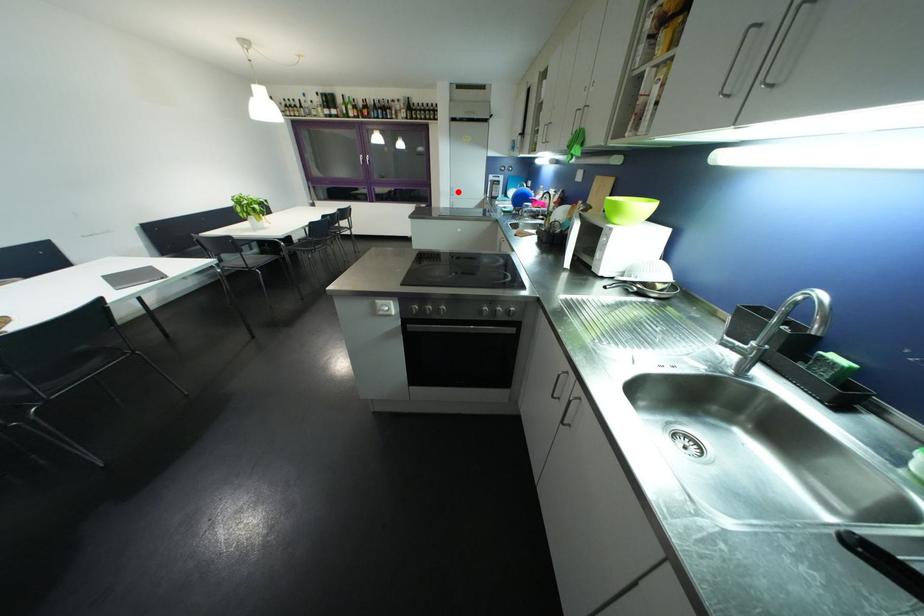
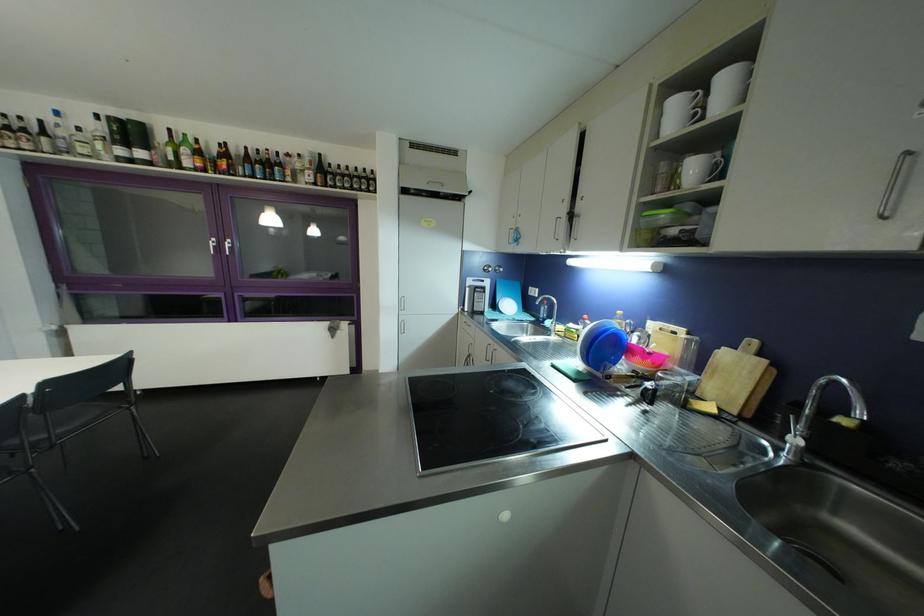
Where in the second image is the point corresponding to the highlighted location from the first image?

(407, 302)